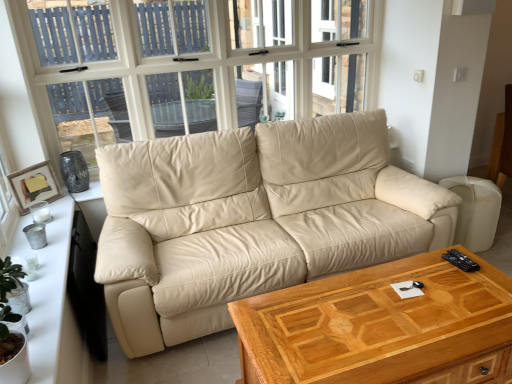
Question: Considering the positions of point (394, 246) and point (309, 281), is point (394, 246) closer or farther from the camera than point (309, 281)?

Choices:
 (A) closer
 (B) farther

Answer: (B)

Question: From a real-world perspective, is beige leather couch at center above or below wooden coffee table at center?

Choices:
 (A) above
 (B) below

Answer: (A)

Question: Which of these objects is positioned farthest from the wooden framed picture at left?

Choices:
 (A) white wood dresser at left
 (B) white glass window at upper center
 (C) wooden coffee table at center
 (D) beige leather couch at center

Answer: (C)

Question: Which object is the closest to the beige leather couch at center?

Choices:
 (A) wooden framed picture at left
 (B) wooden coffee table at center
 (C) white wood dresser at left
 (D) white glass window at upper center

Answer: (B)